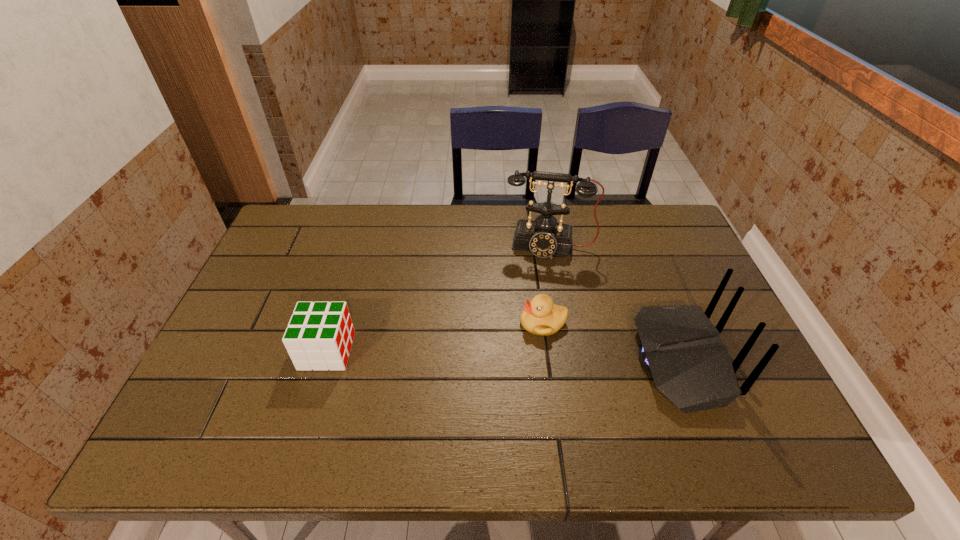
The width and height of the screenshot is (960, 540). In order to click on the second shortest object in this screenshot , I will do `click(319, 336)`.

This screenshot has width=960, height=540. I want to click on cube, so click(319, 336).

Where is `router`? router is located at coordinates (681, 348).

Where is `the second tallest object`? the second tallest object is located at coordinates point(681,348).

You are a GUI agent. You are given a task and a screenshot of the screen. Output one action in this format:
    pyautogui.click(x=<x>, y=<y>)
    Task: Click on the telephone
    This screenshot has height=540, width=960.
    Given the screenshot: What is the action you would take?
    pyautogui.click(x=543, y=236)

The height and width of the screenshot is (540, 960). Identify the location of the farthest object. (543, 236).

This screenshot has width=960, height=540. I want to click on the shortest object, so click(x=540, y=316).

You are a GUI agent. You are given a task and a screenshot of the screen. Output one action in this format:
    pyautogui.click(x=<x>, y=<y>)
    Task: Click on the vacant space located 0.210m on the red face of the cube
    The height and width of the screenshot is (540, 960).
    Given the screenshot: What is the action you would take?
    [434, 351]

Image resolution: width=960 pixels, height=540 pixels. I want to click on free space located 0.300m on the dial of the tallest object, so click(536, 336).

I want to click on vacant space located 0.150m on the dial of the tallest object, so click(x=540, y=295).